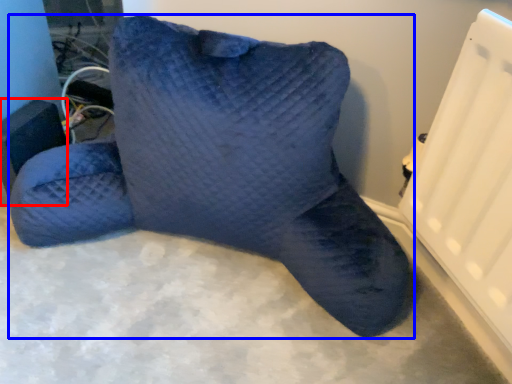
Question: Which object appears farthest to the camera in this image, speaker (highlighted by a red box) or furniture (highlighted by a blue box)?

Choices:
 (A) speaker
 (B) furniture

Answer: (A)